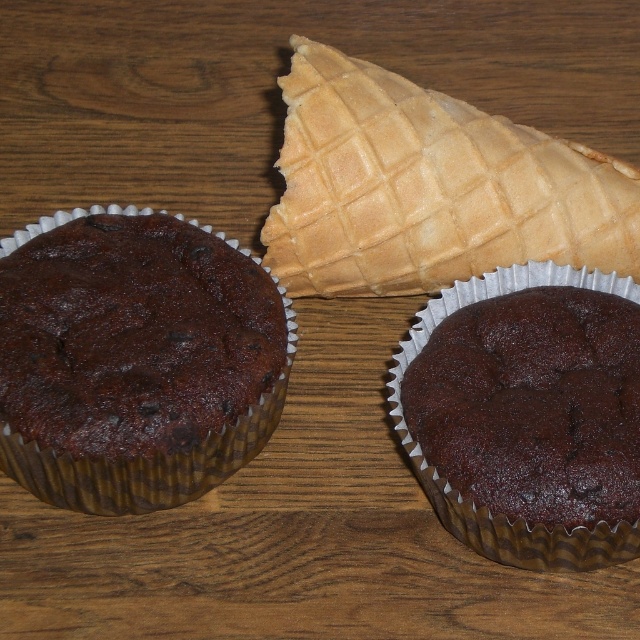
Can you confirm if golden-brown waffle cone at upper center is positioned below chocolate matte muffin at left?

No, golden-brown waffle cone at upper center is not below chocolate matte muffin at left.

Between golden-brown waffle cone at upper center and chocolate matte muffin at left, which one is positioned higher?

Positioned higher is golden-brown waffle cone at upper center.

This screenshot has height=640, width=640. Identify the location of golden-brown waffle cone at upper center. (428, 188).

Is point (596, 221) positioned in front of point (420, 316)?

No, (596, 221) is behind (420, 316).

Can you confirm if golden-brown waffle cone at upper center is positioned to the left of dark matte chocolate muffin at center?

Yes, golden-brown waffle cone at upper center is to the left of dark matte chocolate muffin at center.

Describe the element at coordinates (428, 188) in the screenshot. I see `golden-brown waffle cone at upper center` at that location.

The height and width of the screenshot is (640, 640). Identify the location of golden-brown waffle cone at upper center. (428, 188).

Between chocolate matte muffin at left and dark matte chocolate muffin at center, which one appears on the left side from the viewer's perspective?

chocolate matte muffin at left is more to the left.

Based on the photo, is chocolate matte muffin at left wider than dark matte chocolate muffin at center?

Indeed, chocolate matte muffin at left has a greater width compared to dark matte chocolate muffin at center.

At what (x,y) coordinates should I click in order to perform the action: click on chocolate matte muffin at left. Please return your answer as a coordinate pair (x, y). Looking at the image, I should click on (147, 460).